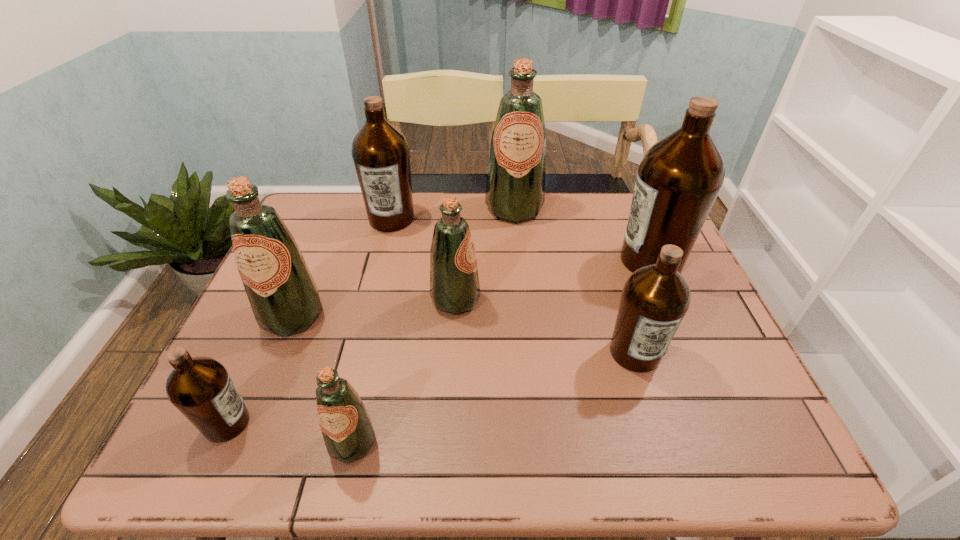
Locate an element on the screen. This screenshot has width=960, height=540. vacant space located on the label of the third farthest brown olive oil is located at coordinates (663, 443).

Where is `vacant space located on the label of the smallest brown olive oil`? This screenshot has width=960, height=540. vacant space located on the label of the smallest brown olive oil is located at coordinates (418, 423).

The image size is (960, 540). I want to click on object at the near left corner, so click(x=200, y=388).

I want to click on vacant region at the far edge of the desktop, so click(x=527, y=224).

This screenshot has height=540, width=960. In the image, there is a desktop. Find the location of `vacant space at the near edge`. vacant space at the near edge is located at coordinates (532, 429).

In order to click on vacant region at the left edge of the desktop in this screenshot , I will do `click(330, 237)`.

The width and height of the screenshot is (960, 540). I want to click on vacant space at the right edge of the desktop, so click(686, 340).

This screenshot has height=540, width=960. In order to click on vacant area at the far right corner of the desktop in this screenshot , I will do [x=624, y=199].

The width and height of the screenshot is (960, 540). In order to click on free space that is in between the third smallest brown olive oil and the biggest brown olive oil in this screenshot , I will do [x=521, y=240].

I want to click on free space between the fourth object from right to left and the farthest green olive oil, so click(x=485, y=254).